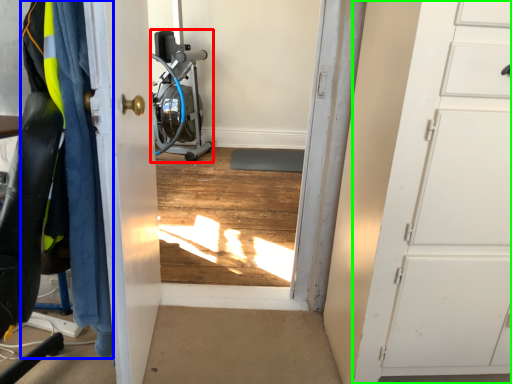
Question: Which object is the closest to the sport equipment (highlighted by a red box)? Choose among these: clothing (highlighted by a blue box) or door (highlighted by a green box).

Choices:
 (A) clothing
 (B) door

Answer: (A)